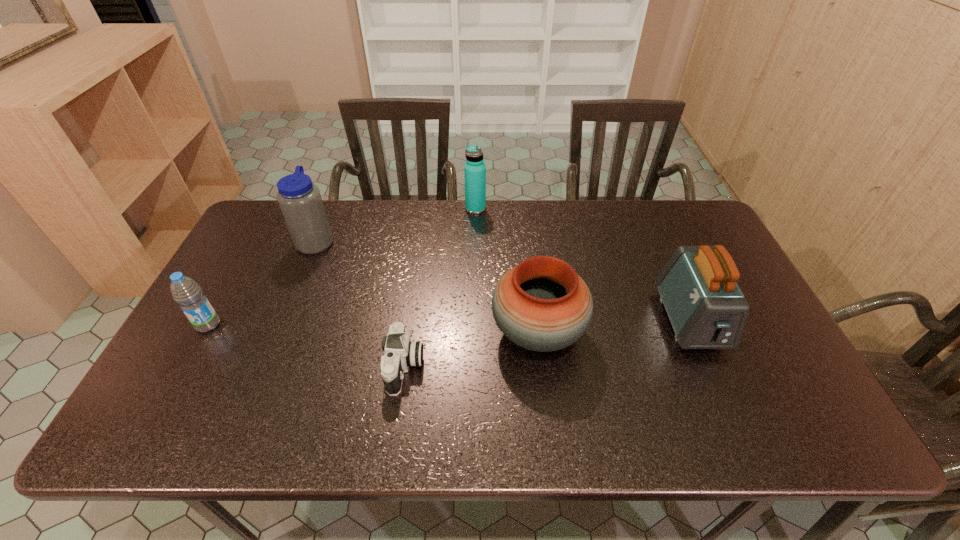
Where is `vacant point located on the front of the rightmost water bottle`? The width and height of the screenshot is (960, 540). vacant point located on the front of the rightmost water bottle is located at coordinates (475, 272).

I want to click on free space located with a carrying loop on the side of the second nearest water bottle, so click(406, 240).

The image size is (960, 540). Find the location of `vacant point located 0.180m on the front-facing side of the rightmost object`. vacant point located 0.180m on the front-facing side of the rightmost object is located at coordinates (735, 426).

The image size is (960, 540). Find the location of `blank space located on the back of the pottery`. blank space located on the back of the pottery is located at coordinates (526, 231).

Where is `free space located on the back of the leftmost object`? free space located on the back of the leftmost object is located at coordinates (247, 256).

You are a GUI agent. You are given a task and a screenshot of the screen. Output one action in this format:
    pyautogui.click(x=<x>, y=<y>)
    Task: Click on the free region located on the right of the third object from left to right
    The image size is (960, 540).
    Given the screenshot: What is the action you would take?
    pyautogui.click(x=460, y=367)

Where is `object at the left edge`? Image resolution: width=960 pixels, height=540 pixels. object at the left edge is located at coordinates (186, 292).

I want to click on object that is at the right edge, so click(x=707, y=310).

At what (x,y) coordinates should I click in order to perform the action: click on free space at the far edge. Please return your answer as a coordinate pair (x, y). The image size is (960, 540). Looking at the image, I should click on (627, 202).

At what (x,y) coordinates should I click in order to perform the action: click on blank space at the near edge. Please return your answer as a coordinate pair (x, y). The image size is (960, 540). Looking at the image, I should click on (556, 413).